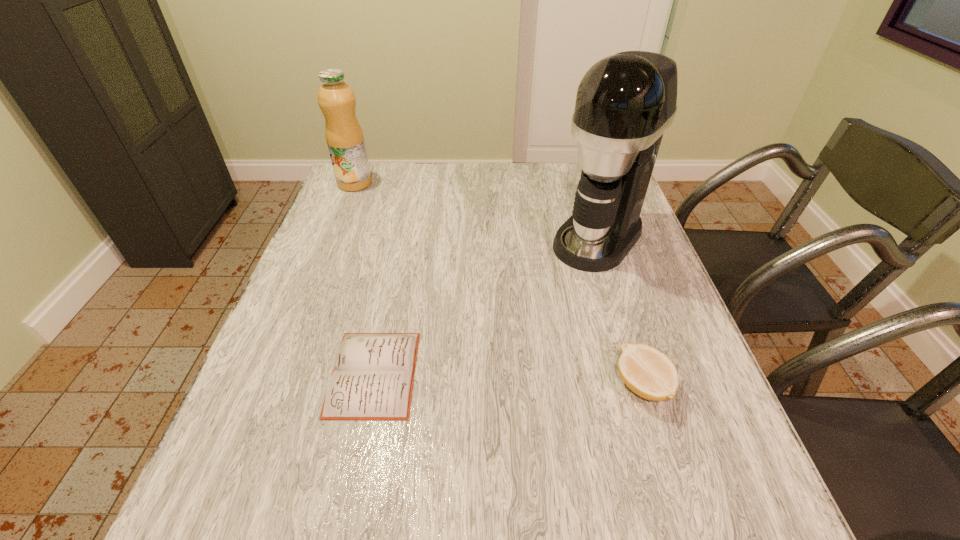
This screenshot has width=960, height=540. In order to click on vacant space that's between the diary and the lemon in this screenshot , I will do `click(508, 380)`.

The width and height of the screenshot is (960, 540). Identify the location of free space between the lemon and the shortest object. (508, 380).

The image size is (960, 540). I want to click on free spot between the coffee maker and the farthest object, so click(x=476, y=211).

At what (x,y) coordinates should I click in order to perform the action: click on free area in between the tallest object and the farthest object. Please return your answer as a coordinate pair (x, y). Looking at the image, I should click on (476, 211).

Image resolution: width=960 pixels, height=540 pixels. Identify the location of vacant space that is in between the coffee maker and the third shortest object. (476, 211).

I want to click on empty space that is in between the second tallest object and the tallest object, so click(476, 211).

What are the coordinates of `free point between the lemon and the tallest object` in the screenshot? It's located at (620, 312).

This screenshot has height=540, width=960. I want to click on unoccupied area between the second tallest object and the shortest object, so click(x=364, y=278).

This screenshot has height=540, width=960. I want to click on free spot between the third nearest object and the leftmost object, so click(x=476, y=211).

Where is `object that can be found as the second closest to the third nearest object`? The height and width of the screenshot is (540, 960). object that can be found as the second closest to the third nearest object is located at coordinates (373, 375).